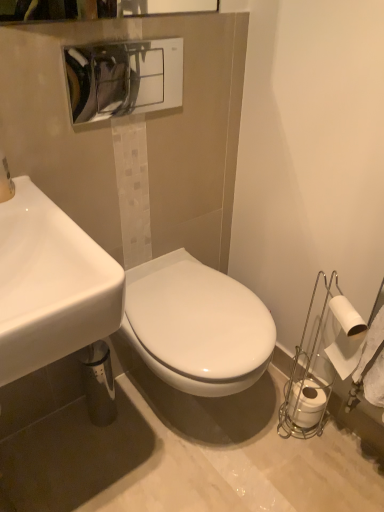
Locate an element on the screen. free space in front of white matte toilet paper at lower right, which appears as the 2th toilet paper when viewed from the front is located at coordinates [313, 466].